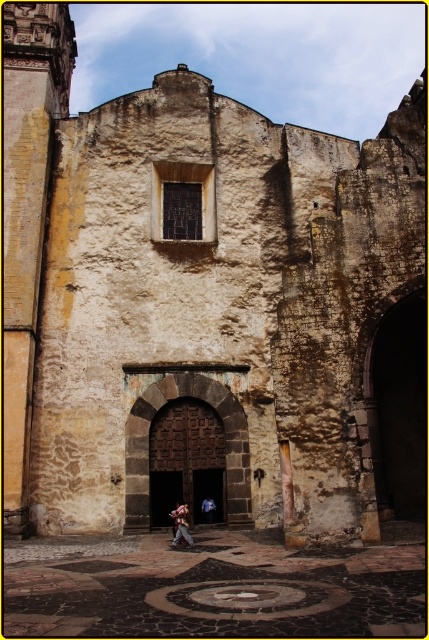
You are standing in front of the aged stone building and notice a point marked at coordinates (181, 524). Based on the scene description, what object is this point located on?

The point at (181, 524) is located on the denim pants at center.